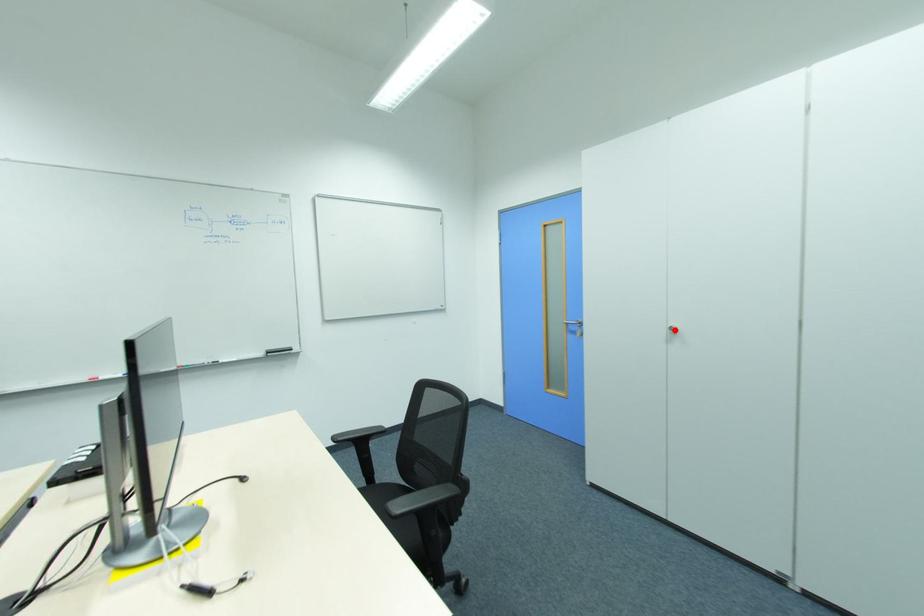
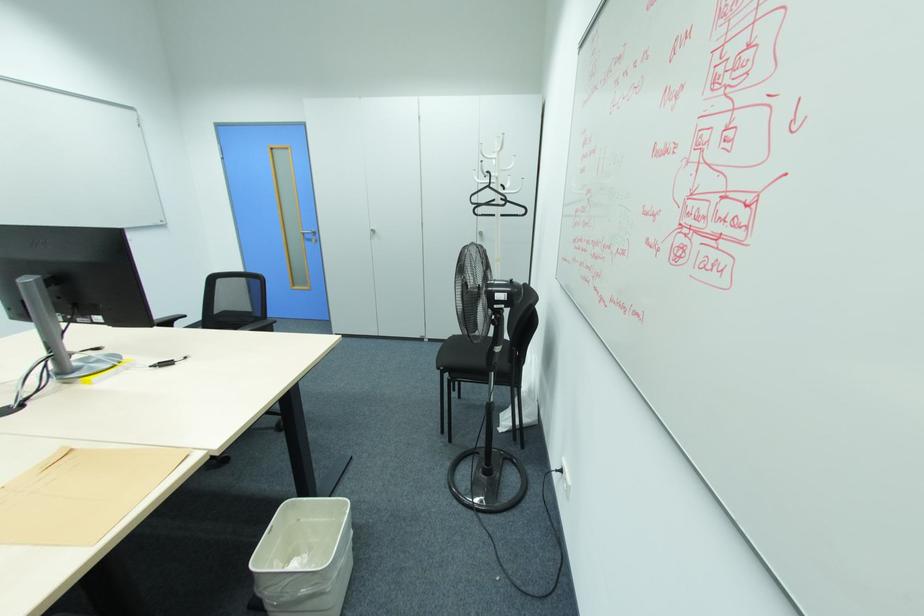
Find the pixel in the second image that matches the highlighted location in the first image.

(373, 231)